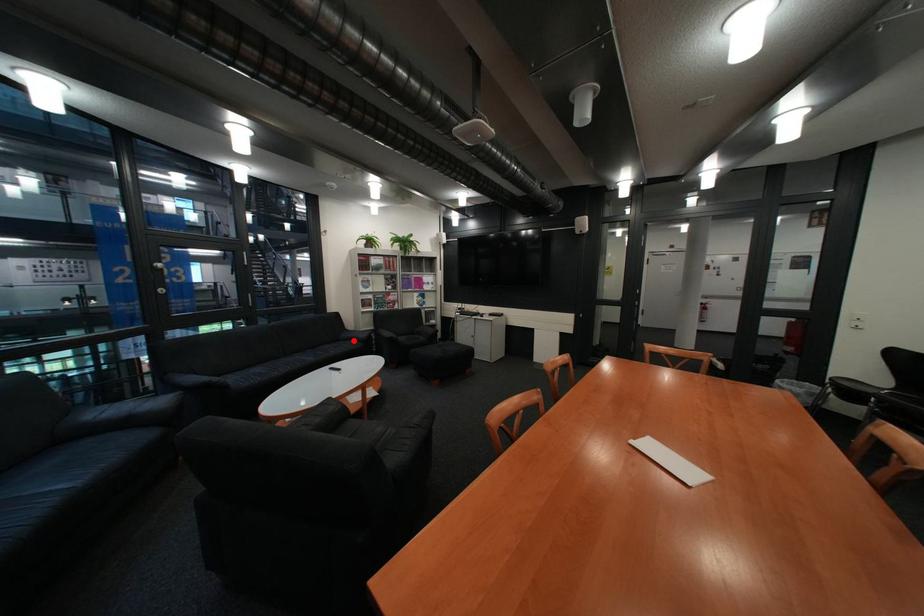
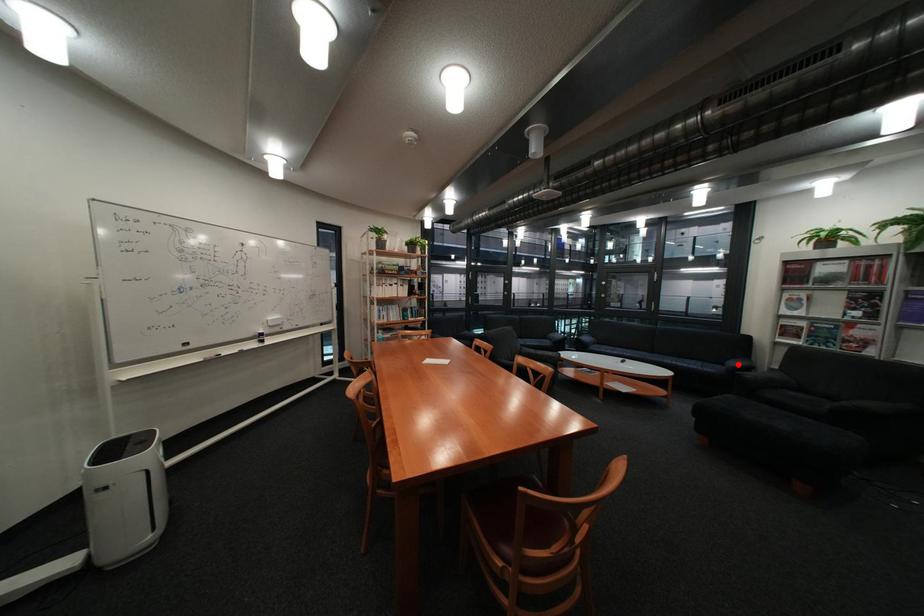
I am providing you with two images of the same scene from different viewpoints. A red point is marked on the first image and another point is marked on the second image. Are the points marked in image1 and image2 representing the same 3D position?

Yes